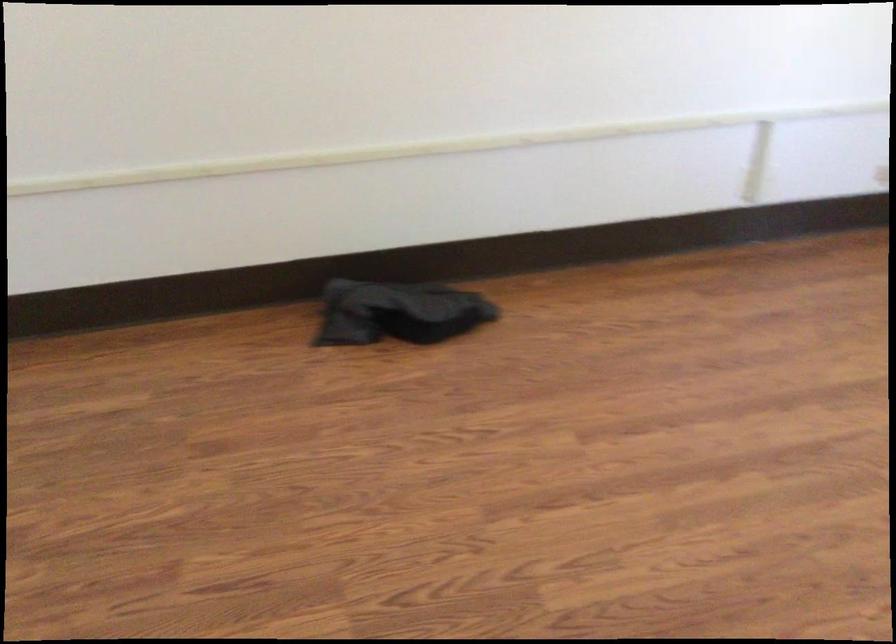
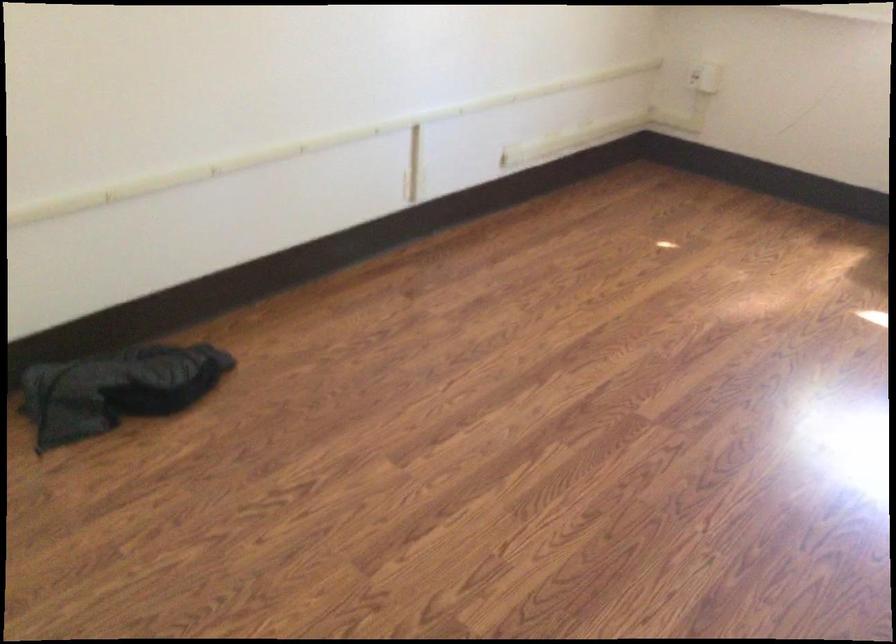
In the second image, find the point that corresponds to (x=470, y=142) in the first image.

(159, 183)